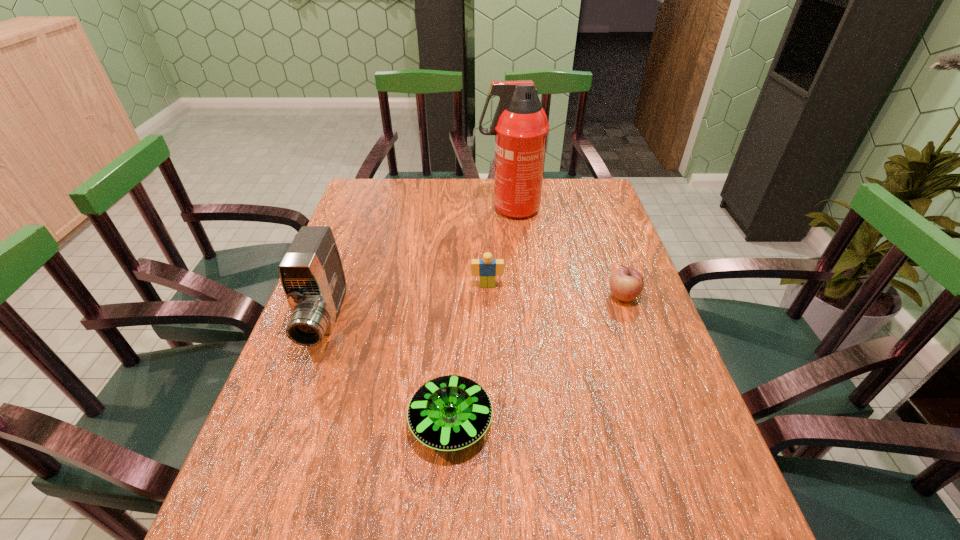
The width and height of the screenshot is (960, 540). Find the location of `vacant point at the far right corner`. vacant point at the far right corner is located at coordinates (572, 214).

At what (x,y) coordinates should I click in order to perform the action: click on free space between the Lego and the tallest object. Please return your answer as a coordinate pair (x, y). The image size is (960, 540). Looking at the image, I should click on (498, 247).

Locate an element on the screen. vacant area that lies between the fourth shortest object and the Lego is located at coordinates (406, 303).

Locate an element on the screen. free spot between the Lego and the saucer is located at coordinates (469, 354).

Locate an element on the screen. The height and width of the screenshot is (540, 960). free area in between the second tallest object and the saucer is located at coordinates (388, 372).

The width and height of the screenshot is (960, 540). In order to click on free point between the fire extinguisher and the apple in this screenshot , I will do `click(566, 253)`.

Locate an element on the screen. This screenshot has height=540, width=960. free space between the rightmost object and the fourth shortest object is located at coordinates (474, 308).

The image size is (960, 540). I want to click on free point between the Lego and the apple, so click(x=555, y=291).

Locate an element on the screen. Image resolution: width=960 pixels, height=540 pixels. vacant area that lies between the fire extinguisher and the leftmost object is located at coordinates (418, 265).

Locate an element on the screen. This screenshot has height=540, width=960. free space that is in between the second tallest object and the rightmost object is located at coordinates (474, 308).